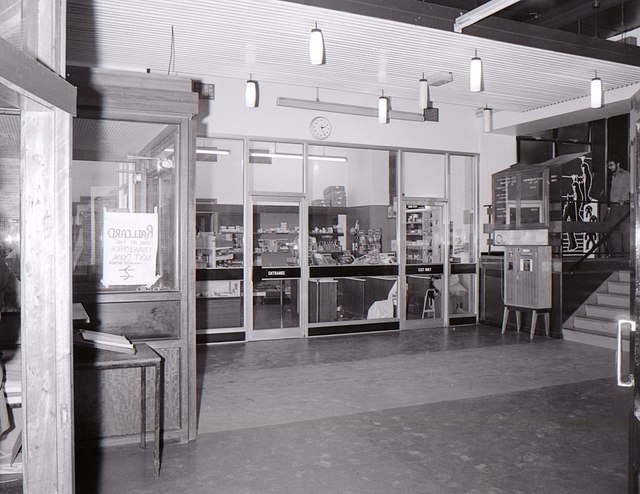
This screenshot has height=494, width=640. What are the coordinates of `ceiling` in the screenshot? It's located at (400, 50).